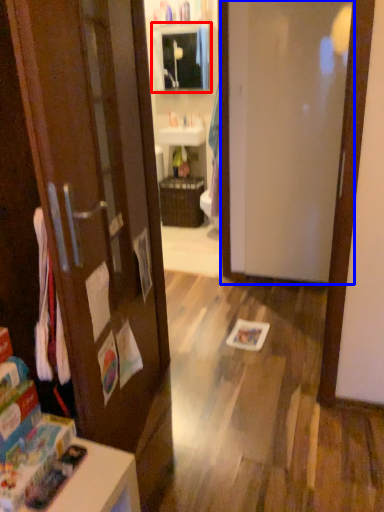
Question: Which point is further to the camera, medicine cabinet (highlighted by a red box) or door (highlighted by a blue box)?

Choices:
 (A) medicine cabinet
 (B) door

Answer: (A)